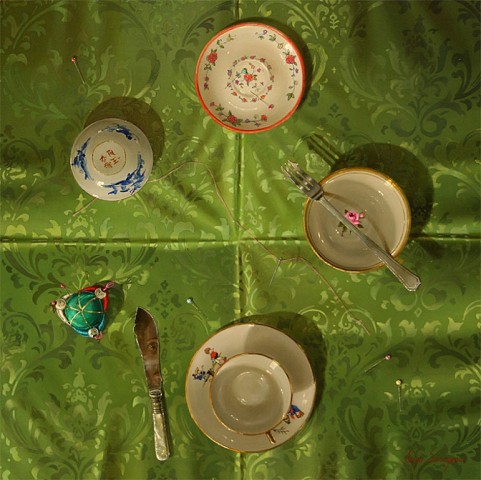
The height and width of the screenshot is (480, 481). Identify the location of topmost saucer. (251, 48).